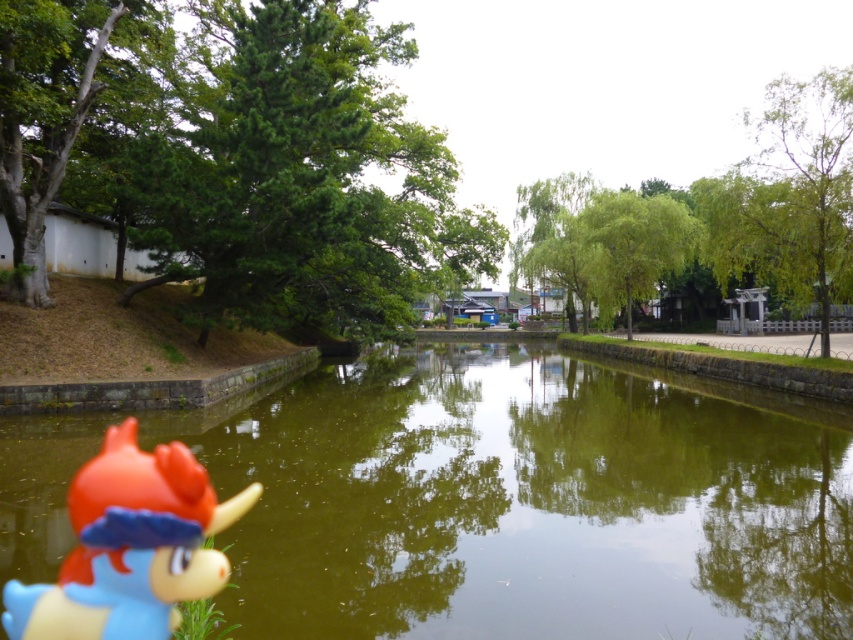
Who is positioned more to the right, green reflective water at center or rubber duck at lower left?

green reflective water at center is more to the right.

Is point (535, 524) less distant than point (202, 513)?

No, it is behind (202, 513).

You are a GUI agent. You are given a task and a screenshot of the screen. Output one action in this format:
    pyautogui.click(x=<x>, y=<y>)
    Task: Click on the green reflective water at center
    
    Given the screenshot: What is the action you would take?
    pyautogui.click(x=527, y=500)